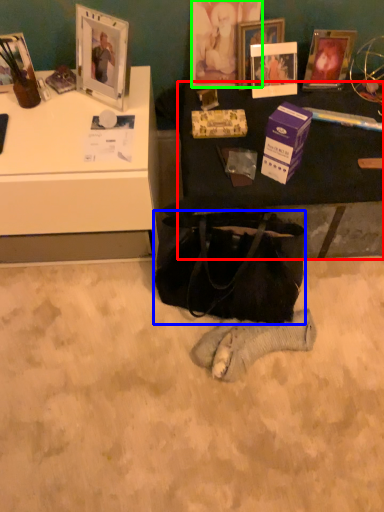
Question: Considering the real-world distances, which object is farthest from table (highlighted by a red box)? handbag (highlighted by a blue box) or picture frame (highlighted by a green box)?

Choices:
 (A) handbag
 (B) picture frame

Answer: (B)